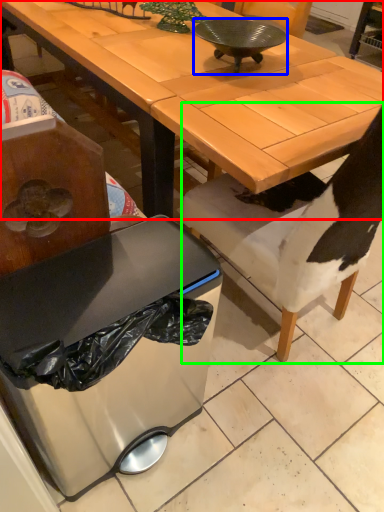
Question: Which is nearer to the desk (highlighted by a red box)? bowl (highlighted by a blue box) or chair (highlighted by a green box).

Choices:
 (A) bowl
 (B) chair

Answer: (A)